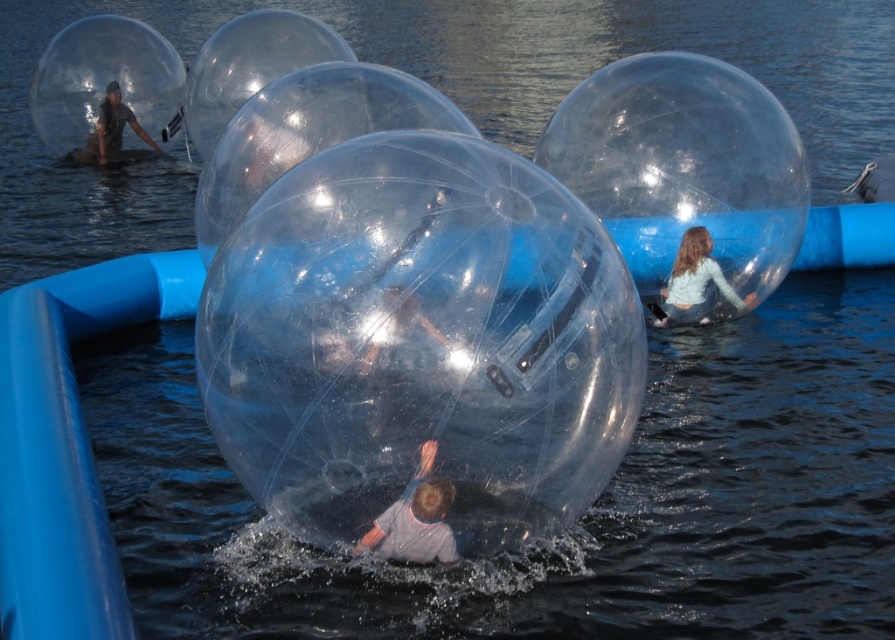
In the scene shown: You are planning to take a photo of the translucent plastic person at center and the transparent plastic person at upper left. Which one should you focus on first if you want to capture both in the same frame without moving the camera?

The translucent plastic person at center is not as tall as transparent plastic person at upper left, so you should focus on the transparent plastic person at upper left first to ensure both are in frame.

You are a photographer trying to capture the scene. You notice two people in plastic balls. Which one is more likely to float higher in the water? The translucent plastic person at center or the transparent plastic person at upper left?

The translucent plastic person at center is thinner than the transparent plastic person at upper left, so it is more likely to float higher in the water because thinner objects displace less water and maintain buoyancy more effectively.

You are a photographer trying to capture a photo of the translucent plastic person at center and the light blue denim jeans at center. Your camera has a maximum focus range of 10 meters. Can you take a photo that includes both subjects clearly?

The distance between the translucent plastic person at center and the light blue denim jeans at center is 8.83 meters, which is within the camera maximum focus range of 10 meters. Therefore, you can take a photo that includes both subjects clearly.